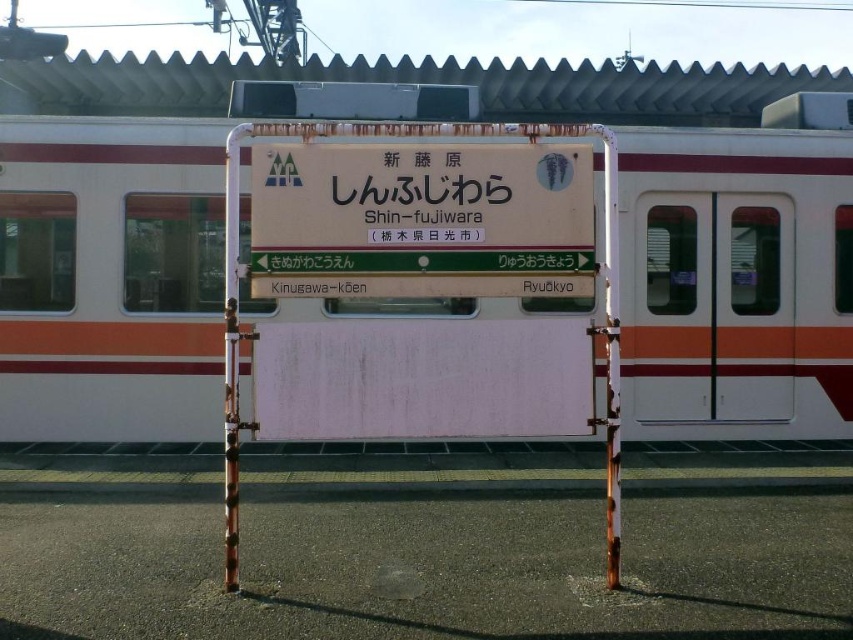
You are a passenger waiting at the Shin Fujiwara train station. You see a white matte train at center and a matte white sign at center. Which object is closer to you?

The white matte train at center is positioned under the matte white sign at center, so the train is closer to you than the sign.

You are standing on the platform and see the white matte train at center and the matte white sign at center. Which object is nearer to you?

The white matte train at center is closer to the viewer than the matte white sign at center, so the white matte train at center is nearer to you.